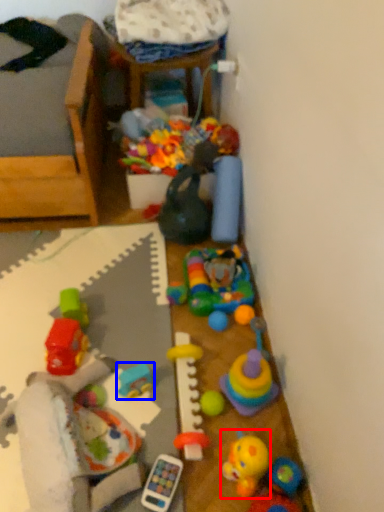
Question: Which object is closer to the camera taking this photo, toy (highlighted by a red box) or toy (highlighted by a blue box)?

Choices:
 (A) toy
 (B) toy

Answer: (A)